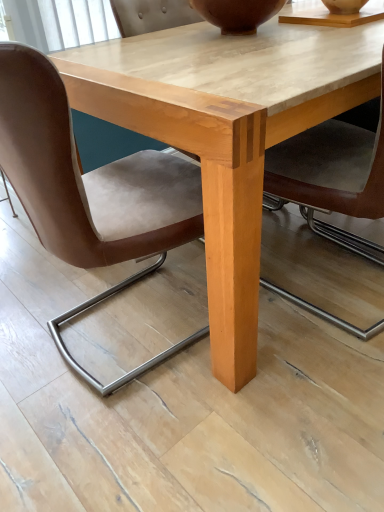
You are a GUI agent. You are given a task and a screenshot of the screen. Output one action in this format:
    pyautogui.click(x=<x>, y=<y>)
    Task: Click on the blank space to the left of brown matte vase at upper center
    This screenshot has width=384, height=512.
    Given the screenshot: What is the action you would take?
    pyautogui.click(x=161, y=40)